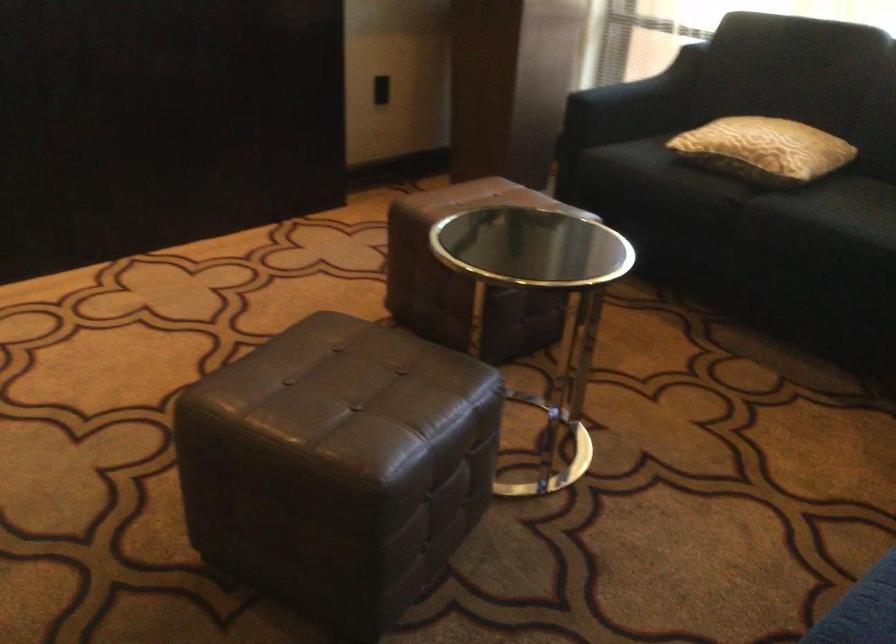
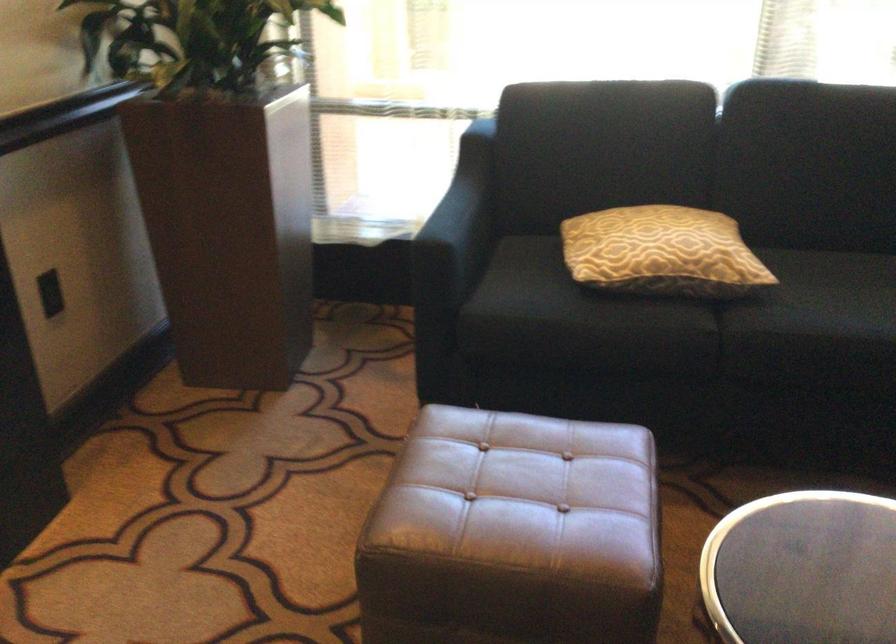
Locate, in the second image, the point that corresponds to [796,183] in the first image.

(752, 289)